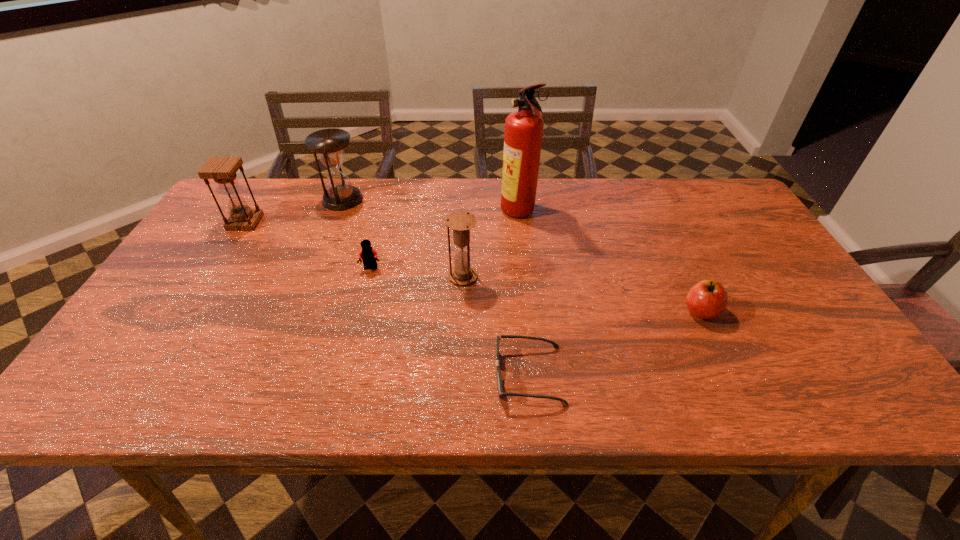
I want to click on fire extinguisher, so pyautogui.click(x=523, y=134).

Where is `the farthest hourglass`? the farthest hourglass is located at coordinates (329, 144).

Identify the location of the second hourglass from right to left. (329, 144).

Where is `the second nearest hourglass`? This screenshot has height=540, width=960. the second nearest hourglass is located at coordinates (222, 170).

You are a GUI agent. You are given a task and a screenshot of the screen. Output one action in this format:
    pyautogui.click(x=<x>, y=<y>)
    Task: Click on the leftmost object
    This screenshot has width=960, height=540.
    Given the screenshot: What is the action you would take?
    pyautogui.click(x=222, y=170)

The image size is (960, 540). Identify the location of the rightmost hourglass. [x=461, y=222].

Identify the location of the nearest hourglass. (461, 222).

Locate an element on the screen. The image size is (960, 540). the fifth object from right to left is located at coordinates (368, 255).

Image resolution: width=960 pixels, height=540 pixels. In order to click on the second nearest object in this screenshot , I will do `click(707, 299)`.

What are the coordinates of `apple` in the screenshot? It's located at (707, 299).